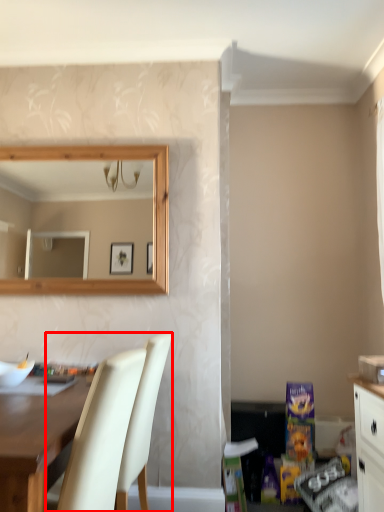
Question: Considering the relative positions of chair (annotated by the red box) and desk in the image provided, where is chair (annotated by the red box) located with respect to the staircase?

Choices:
 (A) right
 (B) left

Answer: (A)